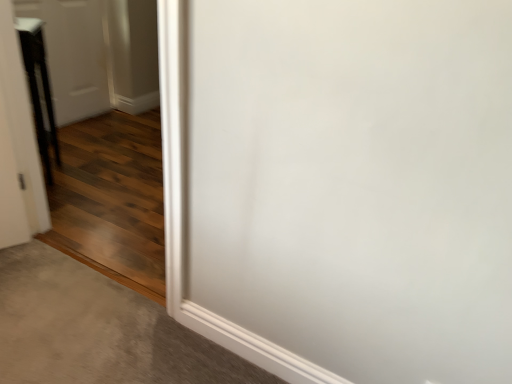
Question: Should I look upward or downward to see gray carpet at lower left?

Choices:
 (A) up
 (B) down

Answer: (B)

Question: Can you confirm if black glossy door at left, the 2th door viewed from the back, is positioned to the left of gray carpet at lower left?

Choices:
 (A) yes
 (B) no

Answer: (A)

Question: Does black glossy door at left, positioned as the first door in front-to-back order, have a smaller size compared to gray carpet at lower left?

Choices:
 (A) yes
 (B) no

Answer: (B)

Question: Could you tell me if black glossy door at left, the 2th door viewed from the back, is facing gray carpet at lower left?

Choices:
 (A) yes
 (B) no

Answer: (B)

Question: Is black glossy door at left, positioned as the first door in front-to-back order, wider than gray carpet at lower left?

Choices:
 (A) yes
 (B) no

Answer: (B)

Question: From a real-world perspective, is black glossy door at left, the 2th door viewed from the back, below gray carpet at lower left?

Choices:
 (A) yes
 (B) no

Answer: (B)

Question: From the image's perspective, is black glossy door at left, positioned as the first door in front-to-back order, under gray carpet at lower left?

Choices:
 (A) no
 (B) yes

Answer: (A)

Question: Is white glossy door at upper left, marked as the 2th door in a front-to-back arrangement, thinner than gray carpet at lower left?

Choices:
 (A) no
 (B) yes

Answer: (B)

Question: From the image's perspective, would you say white glossy door at upper left, marked as the 2th door in a front-to-back arrangement, is shown under gray carpet at lower left?

Choices:
 (A) yes
 (B) no

Answer: (B)

Question: Is white glossy door at upper left, the first door in the back-to-front sequence, bigger than gray carpet at lower left?

Choices:
 (A) yes
 (B) no

Answer: (A)

Question: Considering the relative positions of white glossy door at upper left, the first door in the back-to-front sequence, and gray carpet at lower left in the image provided, is white glossy door at upper left, the first door in the back-to-front sequence, to the right of gray carpet at lower left from the viewer's perspective?

Choices:
 (A) no
 (B) yes

Answer: (A)

Question: Is white glossy door at upper left, marked as the 2th door in a front-to-back arrangement, taller than gray carpet at lower left?

Choices:
 (A) yes
 (B) no

Answer: (A)

Question: Is gray carpet at lower left looking in the opposite direction of white glossy door at upper left, the first door in the back-to-front sequence?

Choices:
 (A) no
 (B) yes

Answer: (A)